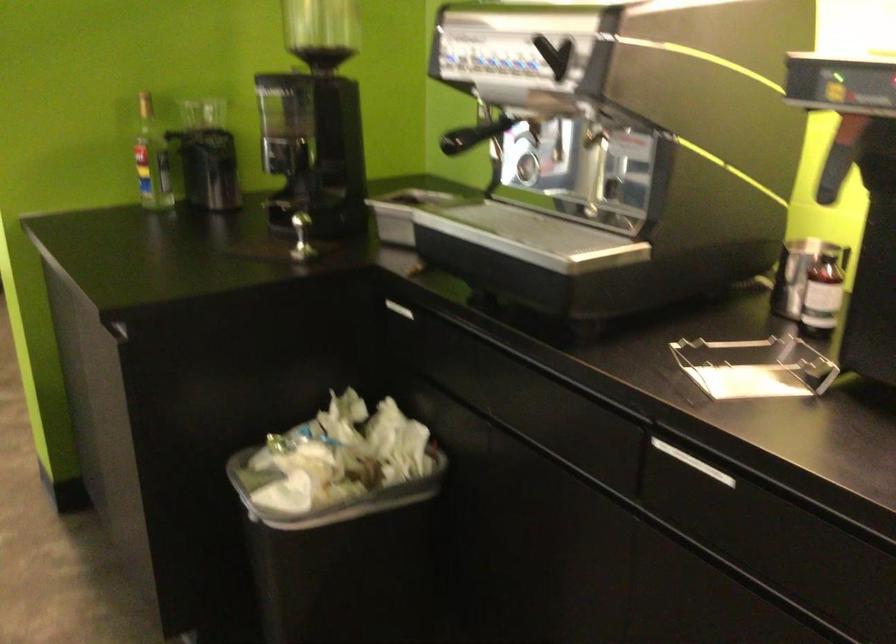
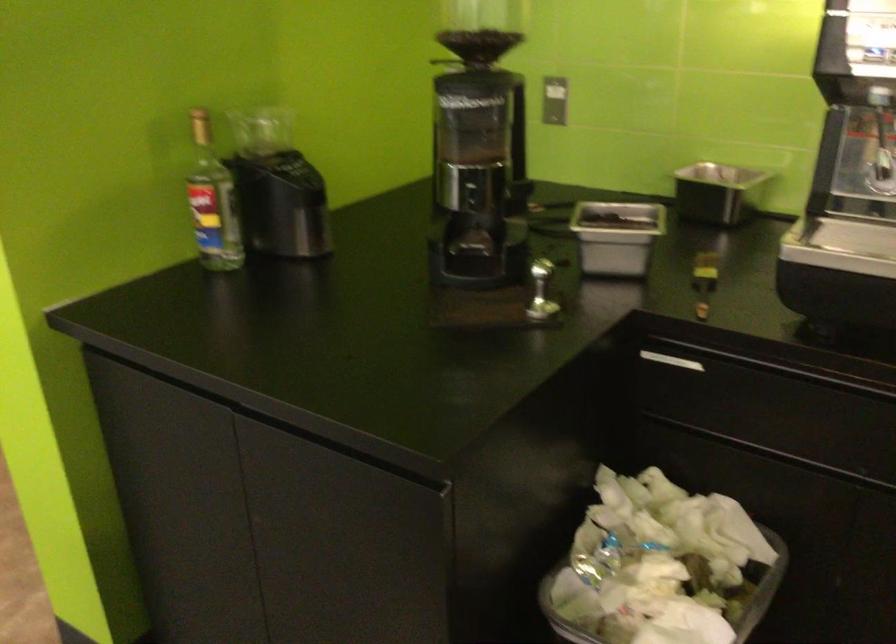
Question: The camera is either moving clockwise (left) or counter-clockwise (right) around the object. The first image is from the beginning of the video and the second image is from the end. Is the camera moving left or right when shooting the video?

Choices:
 (A) Left
 (B) Right

Answer: (A)